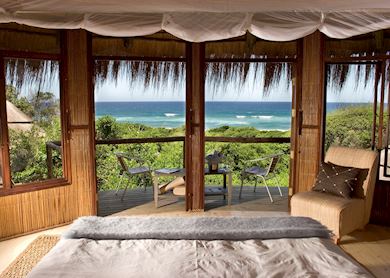
Locate an element on the screen. The width and height of the screenshot is (390, 278). table is located at coordinates (165, 175).